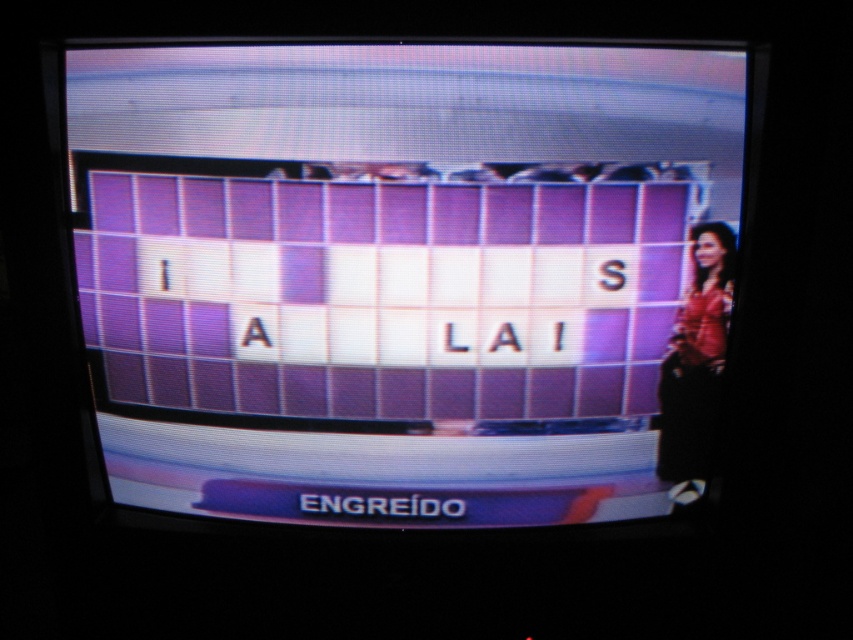
Question: Does purple glossy tiles at center appear under matte pink dress at right?

Choices:
 (A) yes
 (B) no

Answer: (B)

Question: Which point is closer to the camera taking this photo?

Choices:
 (A) (701, 262)
 (B) (508, 108)

Answer: (B)

Question: Can you confirm if purple glossy tiles at center is bigger than matte pink dress at right?

Choices:
 (A) yes
 (B) no

Answer: (A)

Question: Considering the relative positions of purple glossy tiles at center and matte pink dress at right in the image provided, where is purple glossy tiles at center located with respect to matte pink dress at right?

Choices:
 (A) below
 (B) above

Answer: (B)